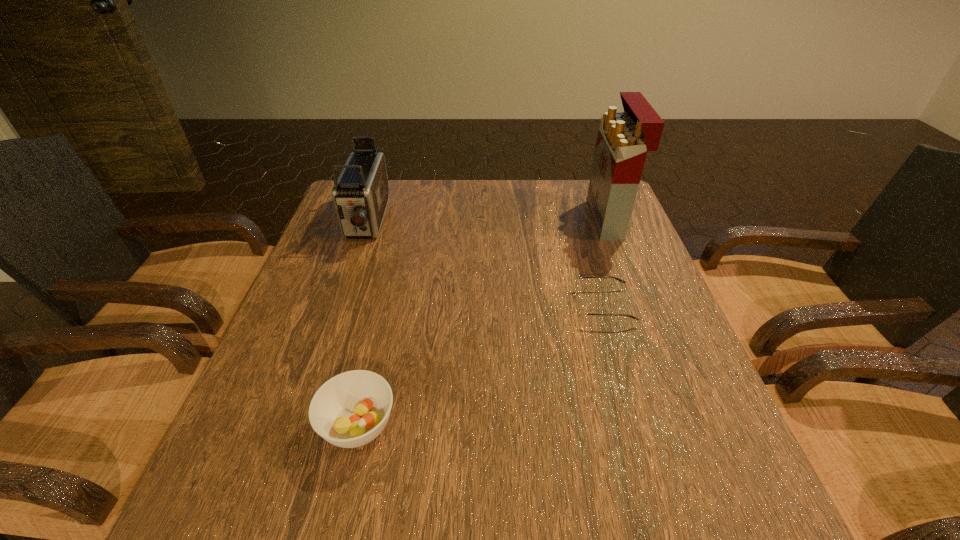
This screenshot has width=960, height=540. In order to click on free spot located 0.090m on the front of the second shortest object in this screenshot , I will do `click(336, 521)`.

Identify the location of vacant area situated on the front-facing side of the shortest object. The image size is (960, 540). (509, 306).

I want to click on free space located on the front-facing side of the shortest object, so click(518, 306).

Where is `free space located on the front-facing side of the shortest object`? free space located on the front-facing side of the shortest object is located at coordinates (418, 306).

The width and height of the screenshot is (960, 540). What are the coordinates of `cigarette case located in the far edge section of the desktop` in the screenshot? It's located at (624, 138).

I want to click on camcorder positioned at the far edge, so click(360, 194).

I want to click on camcorder positioned at the left edge, so click(x=360, y=194).

I want to click on soup bowl that is at the left edge, so click(351, 409).

Where is `cigarette case at the right edge`? cigarette case at the right edge is located at coordinates (624, 138).

You are a GUI agent. You are given a task and a screenshot of the screen. Output one action in this format:
    pyautogui.click(x=<x>, y=<y>)
    Task: Click on the spectacles that is at the right edge
    The height and width of the screenshot is (540, 960).
    Given the screenshot: What is the action you would take?
    pyautogui.click(x=582, y=312)